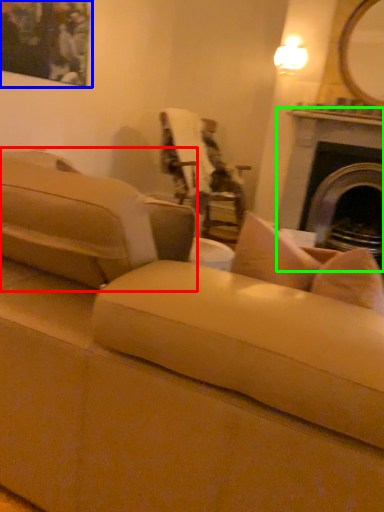
Question: Which object is the farthest from studio couch (highlighted by a red box)? Choose among these: picture frame (highlighted by a blue box) or fireplace (highlighted by a green box).

Choices:
 (A) picture frame
 (B) fireplace

Answer: (B)